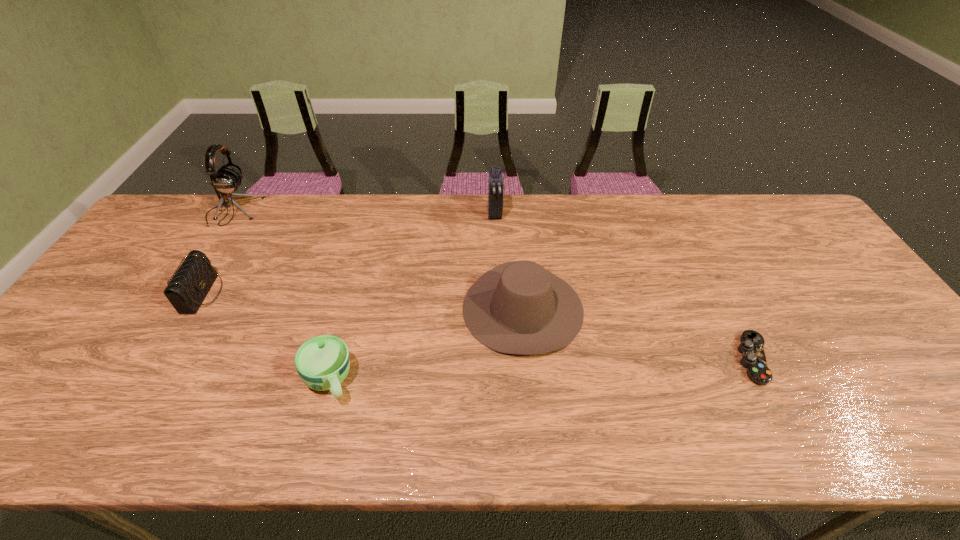
Where is `free space located 0.180m with the zip open on the second tallest object`? The width and height of the screenshot is (960, 540). free space located 0.180m with the zip open on the second tallest object is located at coordinates (496, 262).

Image resolution: width=960 pixels, height=540 pixels. In order to click on blank area located on the right of the third tallest object in this screenshot , I will do `click(707, 308)`.

At what (x,y) coordinates should I click in order to perform the action: click on free spot located 0.180m on the front flap of the shorter clutch bag. Please return your answer as a coordinate pair (x, y). This screenshot has height=540, width=960. Looking at the image, I should click on point(285,294).

Locate an element on the screen. The height and width of the screenshot is (540, 960). free space located on the back of the third object from left to right is located at coordinates pos(357,273).

Locate an element on the screen. This screenshot has height=540, width=960. vacant area situated 0.130m on the back of the control is located at coordinates [722, 295].

What are the coordinates of `earphone that is at the far edge` in the screenshot? It's located at (227, 179).

You are a GUI agent. You are given a task and a screenshot of the screen. Output one action in this format:
    pyautogui.click(x=<x>, y=<y>)
    Task: Click on the clutch bag that is at the far edge
    The width and height of the screenshot is (960, 540).
    Given the screenshot: What is the action you would take?
    pyautogui.click(x=495, y=181)

Identify the location of object that is at the left edge. (227, 179).

Locate an element on the screen. The width and height of the screenshot is (960, 540). object at the far left corner is located at coordinates (227, 179).

You are a GUI agent. You are given a task and a screenshot of the screen. Output one action in this format:
    pyautogui.click(x=<x>, y=<y>)
    Task: Click on the vacant space at the far edge of the desktop
    
    Given the screenshot: What is the action you would take?
    pyautogui.click(x=633, y=213)